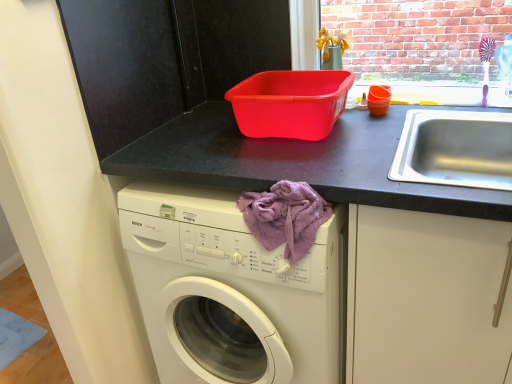
Question: From a real-world perspective, is matte black counter at upper center located beneath purple fabric at lower center?

Choices:
 (A) no
 (B) yes

Answer: (B)

Question: From a real-world perspective, does matte black counter at upper center stand above purple fabric at lower center?

Choices:
 (A) no
 (B) yes

Answer: (A)

Question: Does matte black counter at upper center have a larger size compared to purple fabric at lower center?

Choices:
 (A) no
 (B) yes

Answer: (B)

Question: Does matte black counter at upper center have a greater width compared to purple fabric at lower center?

Choices:
 (A) yes
 (B) no

Answer: (A)

Question: From the image's perspective, is matte black counter at upper center beneath purple fabric at lower center?

Choices:
 (A) no
 (B) yes

Answer: (B)

Question: Is matte black counter at upper center oriented towards purple fabric at lower center?

Choices:
 (A) yes
 (B) no

Answer: (A)

Question: From the image's perspective, is purple fabric at lower center on top of matte black counter at upper center?

Choices:
 (A) yes
 (B) no

Answer: (A)

Question: Would you say purple fabric at lower center contains matte black counter at upper center?

Choices:
 (A) no
 (B) yes

Answer: (A)

Question: From the image's perspective, is purple fabric at lower center below matte black counter at upper center?

Choices:
 (A) no
 (B) yes

Answer: (A)

Question: Can you confirm if purple fabric at lower center is thinner than matte black counter at upper center?

Choices:
 (A) yes
 (B) no

Answer: (A)

Question: Is purple fabric at lower center facing away from matte black counter at upper center?

Choices:
 (A) no
 (B) yes

Answer: (B)

Question: From a real-world perspective, is purple fabric at lower center below matte black counter at upper center?

Choices:
 (A) no
 (B) yes

Answer: (A)

Question: Is purple fabric at lower center taller or shorter than matte black counter at upper center?

Choices:
 (A) short
 (B) tall

Answer: (A)